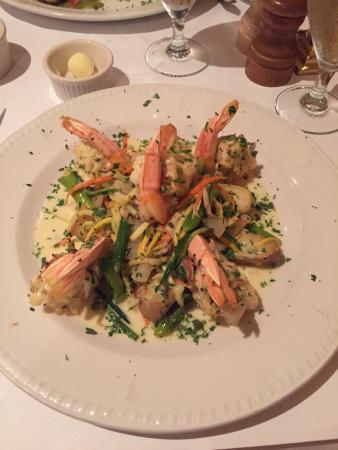
You are a GUI agent. You are given a task and a screenshot of the screen. Output one action in this format:
    pyautogui.click(x=<x>, y=<y>)
    Task: Click on the base of glass
    Image resolution: width=338 pixels, height=450 pixels.
    Given the screenshot: What is the action you would take?
    pyautogui.click(x=178, y=63), pyautogui.click(x=313, y=123)